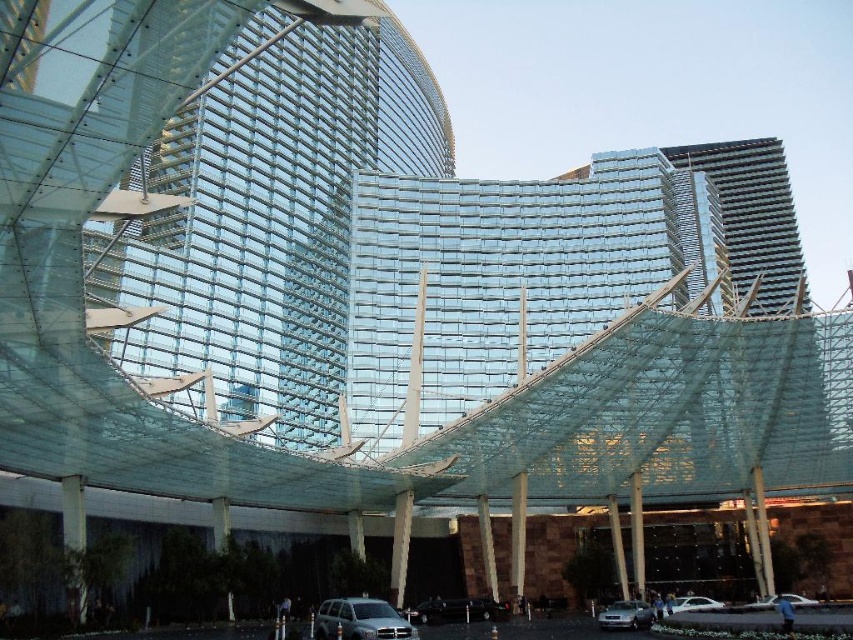
You are standing in front of the modern architectural structure and want to take a photo. There are two points marked on the building, point 1 at coordinates point (367, 634) and point 2 at coordinates point (792, 595). Which point is closer to your camera when taking the photo?

Point (367, 634) is closer to the camera than point (792, 595).

Based on the photo, you are standing at the entrance of the modern architectural structure and see the point labeled as point (360, 620). What object is located at that point?

The point (360, 620) corresponds to the silver metallic suv at lower center.

You are a visitor arriving at the modern architectural structure and see the silver metallic suv at lower center and the silver metallic car at lower center. Which vehicle is blocking the other one from view?

The silver metallic suv at lower center is positioned over the silver metallic car at lower center, so it is blocking the view of the silver metallic car at lower center.